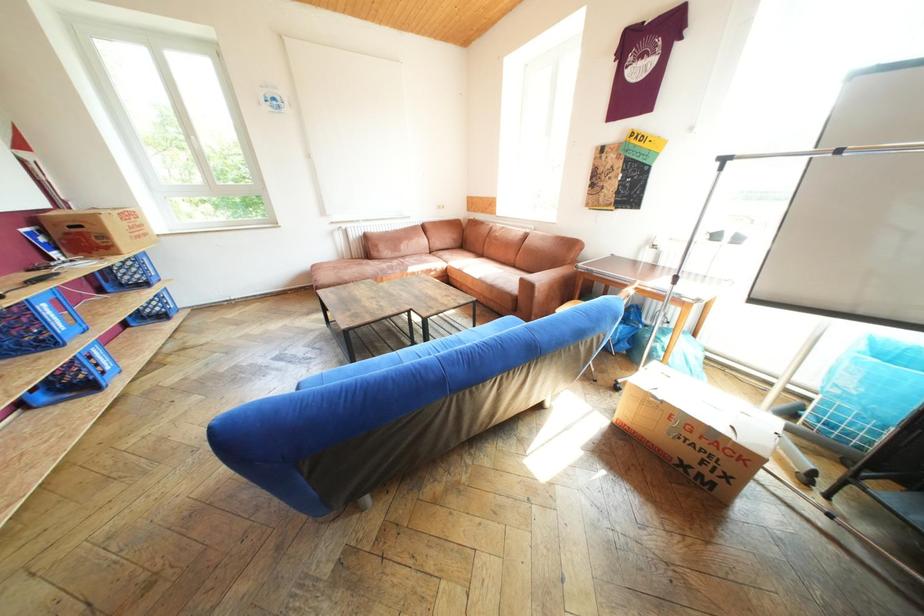
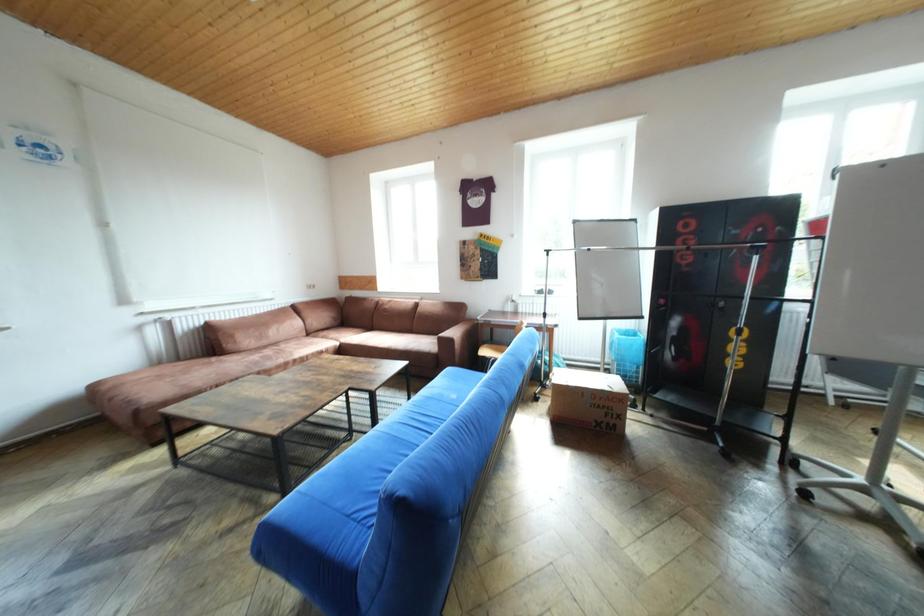
Question: The images are taken continuously from a first-person perspective. In which direction is your viewpoint rotating?

Choices:
 (A) Left
 (B) Right
 (C) Up
 (D) Down

Answer: (B)